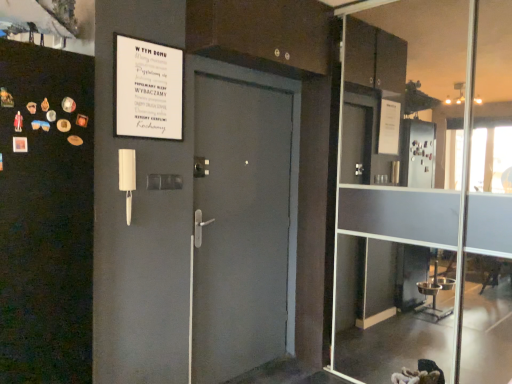
Question: Is white paper sign at upper left at the left side of transparent glass door at center?

Choices:
 (A) no
 (B) yes

Answer: (B)

Question: From the image's perspective, does white paper sign at upper left appear higher than transparent glass door at center?

Choices:
 (A) no
 (B) yes

Answer: (B)

Question: Considering the relative sizes of white paper sign at upper left and transparent glass door at center in the image provided, is white paper sign at upper left smaller than transparent glass door at center?

Choices:
 (A) yes
 (B) no

Answer: (A)

Question: Is white paper sign at upper left facing away from transparent glass door at center?

Choices:
 (A) no
 (B) yes

Answer: (A)

Question: Is white paper sign at upper left aimed at transparent glass door at center?

Choices:
 (A) yes
 (B) no

Answer: (B)

Question: Is white paper sign at upper left placed right next to transparent glass door at center?

Choices:
 (A) yes
 (B) no

Answer: (B)

Question: Would you consider transparent glass door at center to be distant from white paper sign at upper left?

Choices:
 (A) yes
 (B) no

Answer: (A)

Question: Is transparent glass door at center with white paper sign at upper left?

Choices:
 (A) yes
 (B) no

Answer: (B)

Question: Considering the relative sizes of transparent glass door at center and white paper sign at upper left in the image provided, is transparent glass door at center thinner than white paper sign at upper left?

Choices:
 (A) no
 (B) yes

Answer: (A)

Question: From a real-world perspective, is transparent glass door at center physically below white paper sign at upper left?

Choices:
 (A) no
 (B) yes

Answer: (B)

Question: Is the position of transparent glass door at center more distant than that of white paper sign at upper left?

Choices:
 (A) yes
 (B) no

Answer: (B)

Question: From a real-world perspective, is transparent glass door at center positioned over white paper sign at upper left based on gravity?

Choices:
 (A) yes
 (B) no

Answer: (B)

Question: Considering the positions of point (176, 104) and point (362, 105), is point (176, 104) closer or farther from the camera than point (362, 105)?

Choices:
 (A) closer
 (B) farther

Answer: (A)